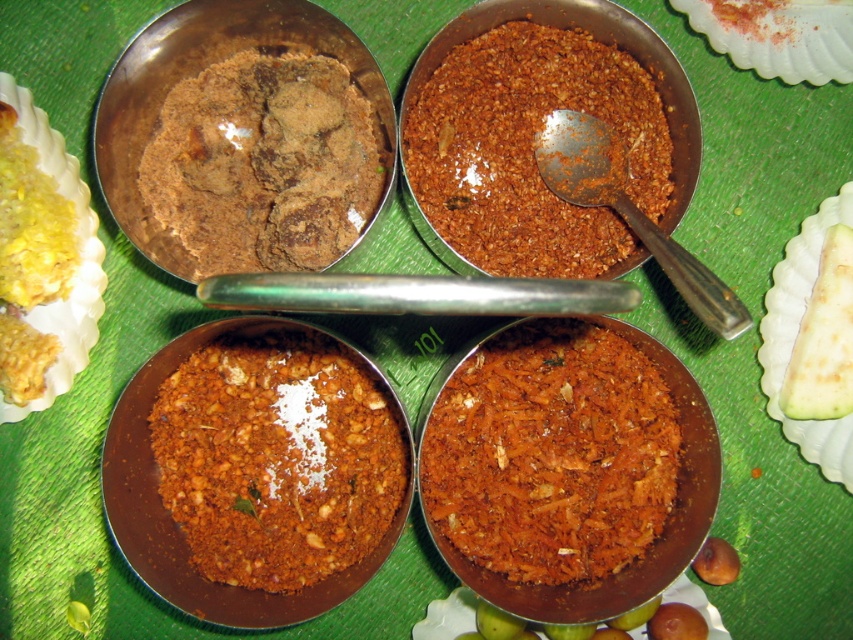
Question: Which point is farther to the camera?

Choices:
 (A) brown crumbly spice mix at center
 (B) brown crumbly food at center
 (C) green matte cucumber at lower right

Answer: (C)

Question: Does brown crumbly spice mix at center appear on the right side of brown matte nut at lower right?

Choices:
 (A) no
 (B) yes

Answer: (A)

Question: Can you confirm if yellow creamy rice at upper left is smaller than yellow matte food at lower left?

Choices:
 (A) yes
 (B) no

Answer: (B)

Question: Among these objects, which one is farthest from the camera?

Choices:
 (A) yellow matte food at lower left
 (B) yellow creamy rice at upper left
 (C) shiny red powder at bottom right

Answer: (A)

Question: Is metallic spoon at upper right positioned in front of brown matte nut at lower right?

Choices:
 (A) no
 (B) yes

Answer: (B)

Question: Estimate the real-world distances between objects in this image. Which object is farther from the brown crumbly food at center?

Choices:
 (A) metallic spoon at upper right
 (B) brown matte nut at lower right
 (C) brown crumbly spice mix at center
 (D) shiny red powder at bottom right

Answer: (B)